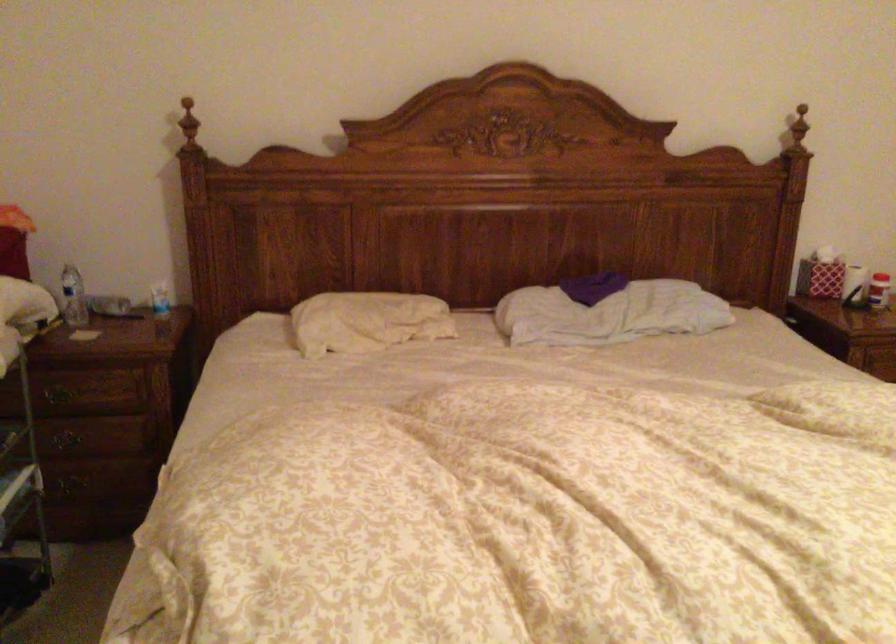
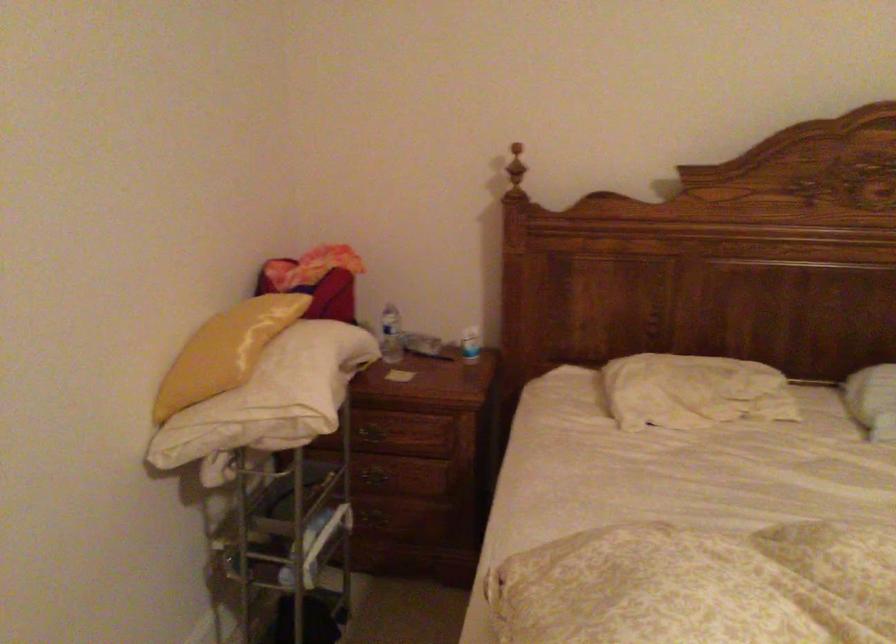
Where in the second image is the point corresponding to point (158, 301) from the first image?

(470, 344)